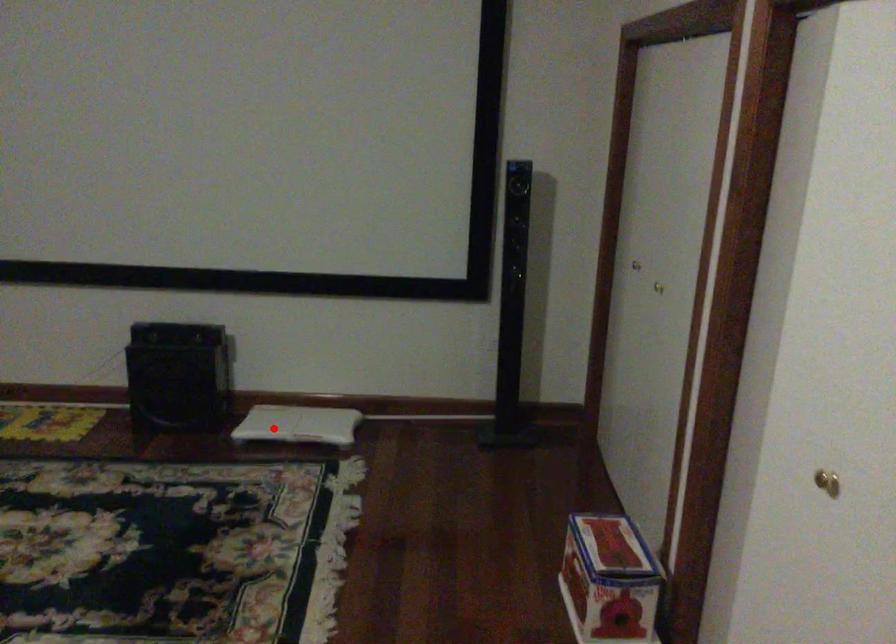
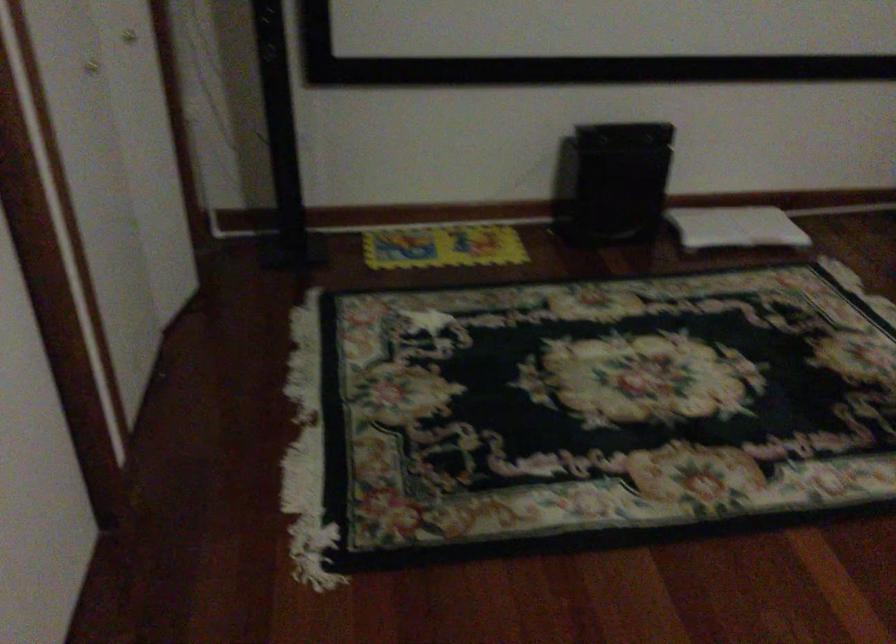
In the second image, find the point that corresponds to the highlighted location in the first image.

(735, 227)